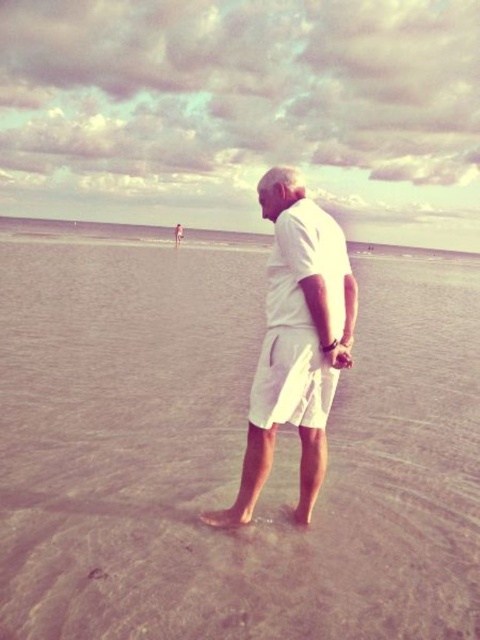
Question: Is sandy beach at center below white cotton shorts at center?

Choices:
 (A) yes
 (B) no

Answer: (B)

Question: Which point appears closest to the camera in this image?

Choices:
 (A) (48, 604)
 (B) (320, 294)

Answer: (A)

Question: Among these objects, which one is farthest from the camera?

Choices:
 (A) sandy beach at center
 (B) white cotton shorts at center

Answer: (B)

Question: Can you confirm if sandy beach at center is thinner than white cotton shorts at center?

Choices:
 (A) no
 (B) yes

Answer: (A)

Question: Does sandy beach at center have a smaller size compared to white cotton shorts at center?

Choices:
 (A) yes
 (B) no

Answer: (B)